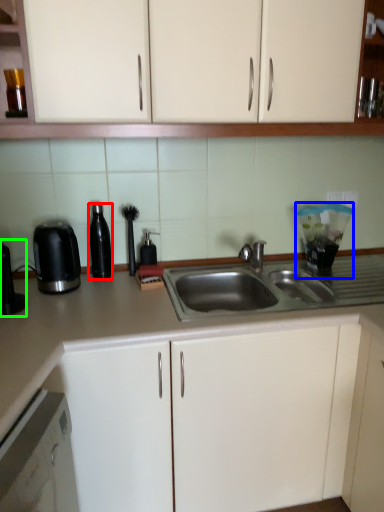
Question: Estimate the real-world distances between objects in this image. Which object is farther from appliance (highlighted by a red box), appliance (highlighted by a blue box) or coffee machine (highlighted by a green box)?

Choices:
 (A) appliance
 (B) coffee machine

Answer: (A)